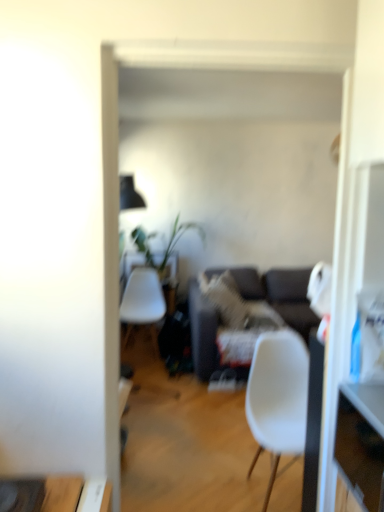
Question: Is dark gray fabric couch at center situated inside white matte chair at center or outside?

Choices:
 (A) inside
 (B) outside

Answer: (B)

Question: Does point (304, 329) appear closer or farther from the camera than point (276, 372)?

Choices:
 (A) farther
 (B) closer

Answer: (A)

Question: Which object is positioned closest to the dark gray fabric couch at center?

Choices:
 (A) green leafy plant at center
 (B) white matte chair at center
 (C) wooden drawer at right
 (D) white plastic desk at center

Answer: (A)

Question: Estimate the real-world distances between objects in this image. Which object is farther from the dark gray fabric couch at center?

Choices:
 (A) wooden drawer at right
 (B) green leafy plant at center
 (C) white matte chair at center
 (D) white plastic desk at center

Answer: (C)